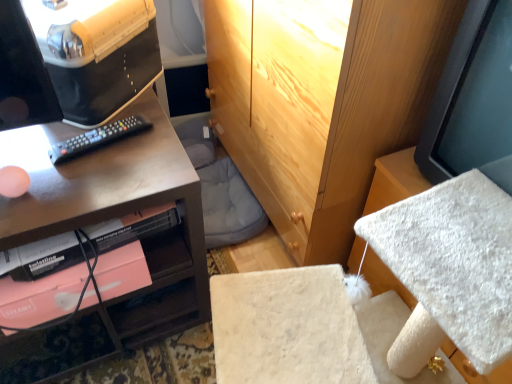
Question: From a real-world perspective, is matte black monitor at upper left above or below matte black monitor at right?

Choices:
 (A) below
 (B) above

Answer: (A)

Question: From their relative heights in the image, would you say matte black monitor at upper left is taller or shorter than matte black monitor at right?

Choices:
 (A) short
 (B) tall

Answer: (A)

Question: Which is nearer to the black plastic remote at left?

Choices:
 (A) matte black desk at left
 (B) matte black monitor at right
 (C) matte black monitor at upper left

Answer: (C)

Question: Which object is positioned farthest from the black plastic remote at left?

Choices:
 (A) matte black monitor at right
 (B) matte black monitor at upper left
 (C) matte black desk at left

Answer: (A)